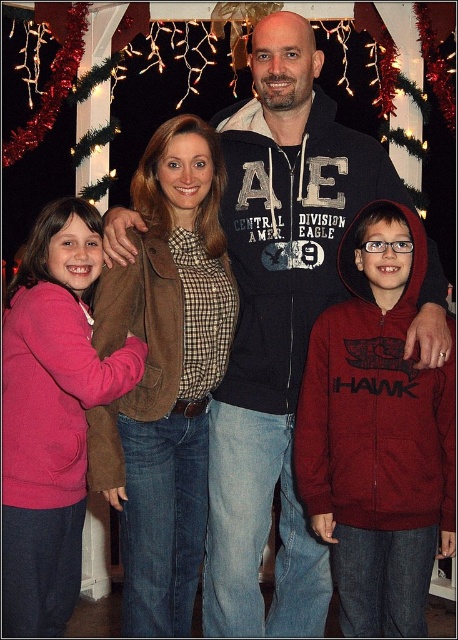
From the picture: Which of these two, brown suede jacket at center or pink fleece sweater at left, stands taller?

Standing taller between the two is pink fleece sweater at left.

From the picture: Does brown suede jacket at center lie behind pink fleece sweater at left?

Yes, it is.

Is point (196, 120) positioned behind point (71, 340)?

That is True.

This screenshot has width=458, height=640. In order to click on brown suede jacket at center in this screenshot , I will do `click(164, 374)`.

Does point (157, 540) come farther from viewer compared to point (380, 515)?

Yes, it is.

Which is more to the right, brown suede jacket at center or burgundy fleece hoodie at center?

From the viewer's perspective, burgundy fleece hoodie at center appears more on the right side.

This screenshot has height=640, width=458. What are the coordinates of `brown suede jacket at center` in the screenshot? It's located at (164, 374).

I want to click on brown suede jacket at center, so click(164, 374).

Does burgundy fleece hoodie at center have a lesser width compared to pink fleece sweater at left?

No.

Is the position of burgundy fleece hoodie at center more distant than that of pink fleece sweater at left?

Yes.

Who is more distant from viewer, (343, 500) or (63, 476)?

Positioned behind is point (63, 476).

I want to click on burgundy fleece hoodie at center, so click(376, 433).